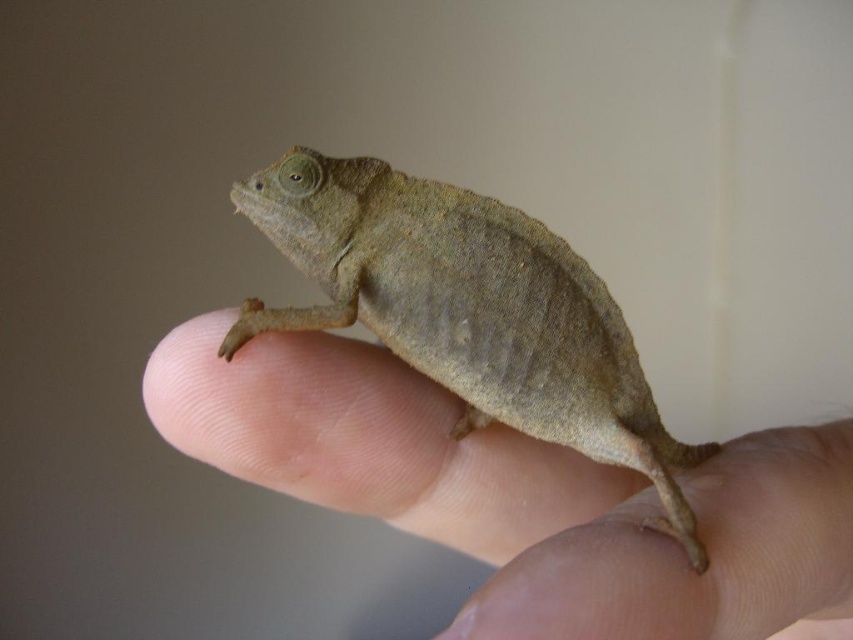
You are a photographer trying to capture a clear photo of the brown textured lizard at center and the matte brown chameleon at center. Which one is easier to focus on due to its position?

The brown textured lizard at center is easier to focus on because it is in front of the matte brown chameleon at center, making it closer to the camera.

You are a wildlife photographer trying to capture a clear image of the brown matte chameleon at center and the matte brown chameleon at center. However, you notice that one of them is partially hidden. Which chameleon is visible on top?

The brown matte chameleon at center is positioned over the matte brown chameleon at center, so the brown matte chameleon at center is visible on top.